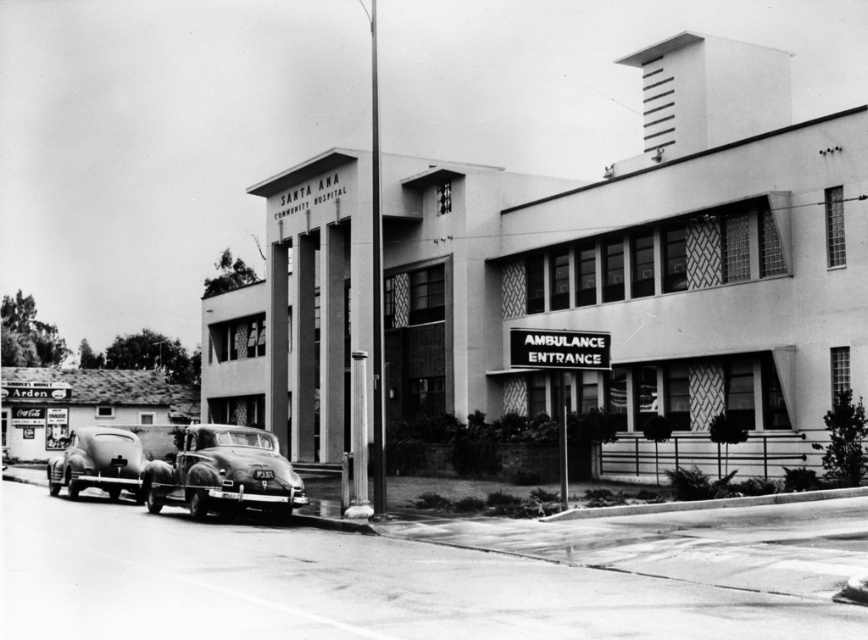
Is point (298, 477) positioned in front of point (76, 442)?

Yes, point (298, 477) is in front of point (76, 442).

Between point (195, 484) and point (116, 477), which one is positioned behind?

The point (116, 477) is behind.

Identify the location of shiny silver car at center. The height and width of the screenshot is (640, 868). (222, 472).